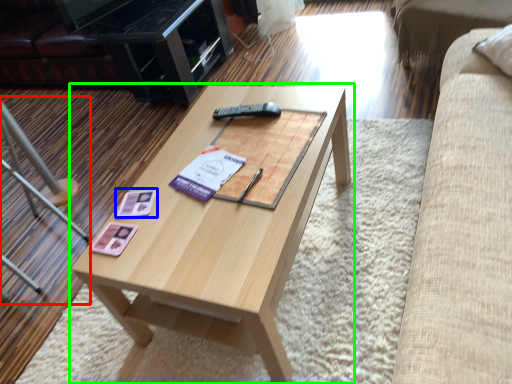
Question: Estimate the real-world distances between objects in this image. Which object is farther from chair (highlighted by a red box), square (highlighted by a blue box) or coffee table (highlighted by a green box)?

Choices:
 (A) square
 (B) coffee table

Answer: (A)